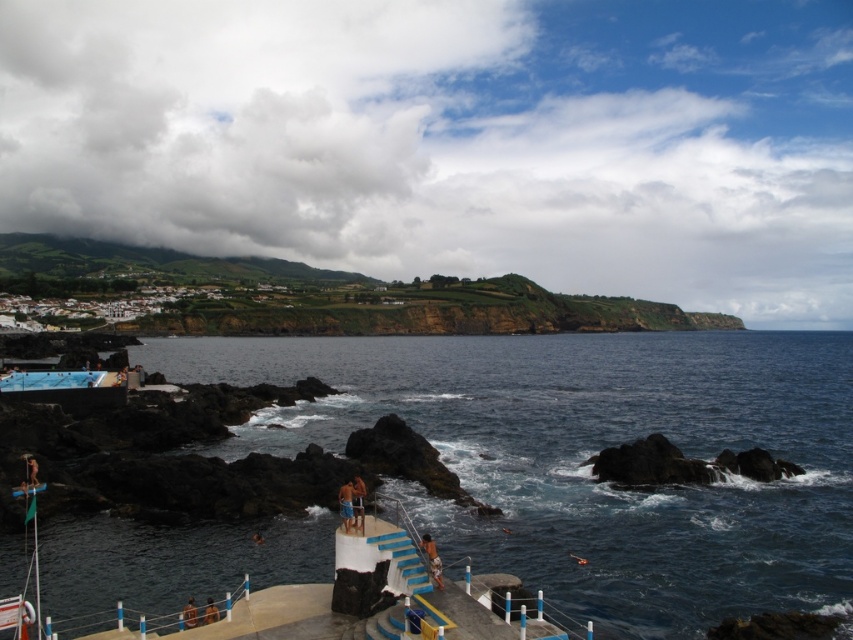
Which is behind, point (430, 545) or point (360, 528)?

The point (430, 545) is behind.

Is the position of tan skin person at lower center more distant than that of tan skin person at center?

No, it is not.

Is point (428, 554) closer to camera compared to point (364, 493)?

Yes, it is.

Find the location of a particular element. tan skin person at lower center is located at coordinates (432, 560).

Is point (346, 515) positioned after point (360, 522)?

No.

Describe the element at coordinates (346, 504) in the screenshot. Image resolution: width=853 pixels, height=640 pixels. I see `blue fabric shorts at lower center` at that location.

You are a GUI agent. You are given a task and a screenshot of the screen. Output one action in this format:
    pyautogui.click(x=<x>, y=<y>)
    Task: Click on the blue fabric shorts at lower center
    This screenshot has width=853, height=640.
    Given the screenshot: What is the action you would take?
    pyautogui.click(x=346, y=504)

Does point (791, 392) come farther from viewer compared to point (209, 621)?

Yes, it is behind point (209, 621).

Which is more to the right, dark blue water at center or brown fabric shorts at lower center?

From the viewer's perspective, dark blue water at center appears more on the right side.

The image size is (853, 640). In order to click on dark blue water at center in this screenshot , I will do `click(589, 456)`.